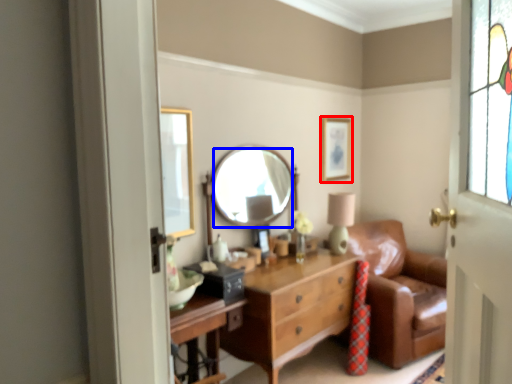
Question: Which object appears closest to the camera in this image, picture frame (highlighted by a red box) or mirror (highlighted by a blue box)?

Choices:
 (A) picture frame
 (B) mirror

Answer: (B)